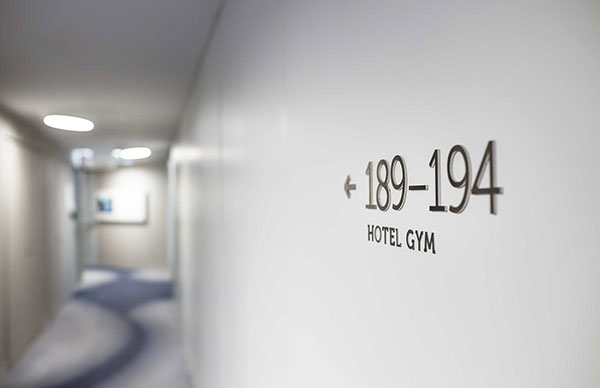
Identify the location of light on ceiling. (68, 125).